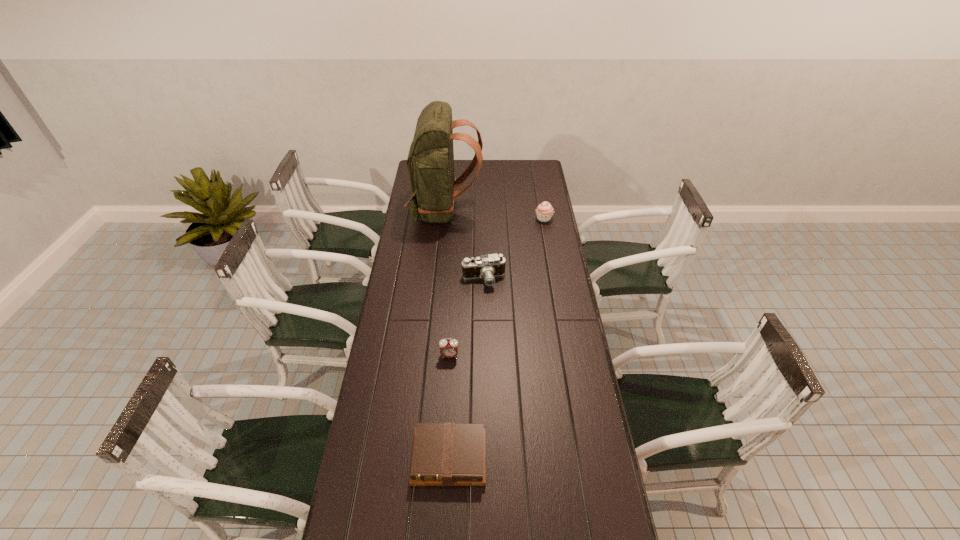
At what (x,y) coordinates should I click in order to perform the action: click on backpack. Please return your answer as a coordinate pair (x, y). The width and height of the screenshot is (960, 540). Looking at the image, I should click on (430, 162).

This screenshot has width=960, height=540. Find the location of `the rightmost object`. the rightmost object is located at coordinates (544, 211).

Identify the location of camera. This screenshot has width=960, height=540. (488, 266).

The height and width of the screenshot is (540, 960). What are the coordinates of `alarm clock` in the screenshot? It's located at (448, 348).

I want to click on the shortest object, so click(x=444, y=454).

Locate an element on the screen. The image size is (960, 540). the nearest object is located at coordinates (444, 454).

Find the location of a particular element. vacant space located on the back of the tallest object is located at coordinates (550, 210).

Find the location of a particular element. Image resolution: width=960 pixels, height=540 pixels. vacant point located 0.160m on the front of the cupcake is located at coordinates (548, 244).

At what (x,y) coordinates should I click in order to perform the action: click on free space located 0.250m at the lens of the third nearest object. Please return your answer as a coordinate pair (x, y). The width and height of the screenshot is (960, 540). Looking at the image, I should click on (484, 334).

Find the location of a particular element. This screenshot has width=960, height=540. vacant point located on the clock face of the alarm clock is located at coordinates (444, 457).